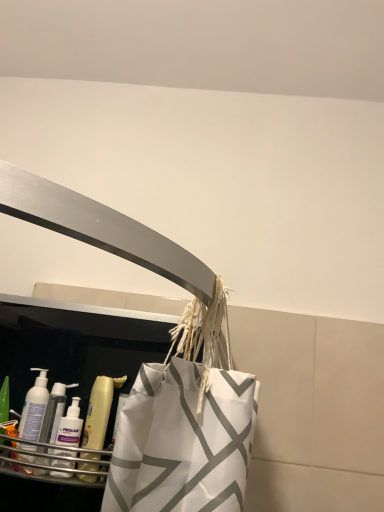
Question: Can you confirm if translucent plastic bottle at left, which is counted as the 1th cleaning product, starting from the right, is smaller than translucent plastic mouthwash at lower left?

Choices:
 (A) no
 (B) yes

Answer: (B)

Question: Is translucent plastic bottle at left, which is counted as the 1th cleaning product, starting from the right, located outside translucent plastic mouthwash at lower left?

Choices:
 (A) yes
 (B) no

Answer: (A)

Question: Is translucent plastic bottle at left, marked as the second cleaning product in a left-to-right arrangement, wider than translucent plastic mouthwash at lower left?

Choices:
 (A) no
 (B) yes

Answer: (A)

Question: Does translucent plastic bottle at left, which is counted as the 1th cleaning product, starting from the right, have a lesser width compared to translucent plastic mouthwash at lower left?

Choices:
 (A) no
 (B) yes

Answer: (B)

Question: Does translucent plastic bottle at left, marked as the second cleaning product in a left-to-right arrangement, turn towards translucent plastic mouthwash at lower left?

Choices:
 (A) no
 (B) yes

Answer: (A)

Question: Can you confirm if translucent plastic bottle at left, marked as the second cleaning product in a left-to-right arrangement, is positioned to the left of translucent plastic mouthwash at lower left?

Choices:
 (A) yes
 (B) no

Answer: (A)

Question: From a real-world perspective, is translucent plastic bottle at left, marked as the second cleaning product in a left-to-right arrangement, located beneath white plastic bottle at lower left, which is the 1th cleaning product in left-to-right order?

Choices:
 (A) yes
 (B) no

Answer: (A)

Question: Is translucent plastic bottle at left, marked as the second cleaning product in a left-to-right arrangement, behind white plastic bottle at lower left, which is the 1th cleaning product in left-to-right order?

Choices:
 (A) yes
 (B) no

Answer: (B)

Question: Is translucent plastic bottle at left, which is counted as the 1th cleaning product, starting from the right, wider than white plastic bottle at lower left, which is the 1th cleaning product in left-to-right order?

Choices:
 (A) yes
 (B) no

Answer: (B)

Question: Does translucent plastic bottle at left, marked as the second cleaning product in a left-to-right arrangement, have a lesser width compared to white plastic bottle at lower left, which is the 1th cleaning product in left-to-right order?

Choices:
 (A) no
 (B) yes

Answer: (B)

Question: Is translucent plastic bottle at left, marked as the second cleaning product in a left-to-right arrangement, positioned with its back to white plastic bottle at lower left, which is the 1th cleaning product in left-to-right order?

Choices:
 (A) yes
 (B) no

Answer: (B)

Question: Considering the relative sizes of translucent plastic bottle at left, which is counted as the 1th cleaning product, starting from the right, and white plastic bottle at lower left, which is the second cleaning product from right to left, in the image provided, is translucent plastic bottle at left, which is counted as the 1th cleaning product, starting from the right, smaller than white plastic bottle at lower left, which is the second cleaning product from right to left,?

Choices:
 (A) yes
 (B) no

Answer: (A)

Question: From the image's perspective, does white plastic bottle at lower left, which is the second cleaning product from right to left, appear higher than translucent plastic bottle at left, which is counted as the 1th cleaning product, starting from the right?

Choices:
 (A) no
 (B) yes

Answer: (B)